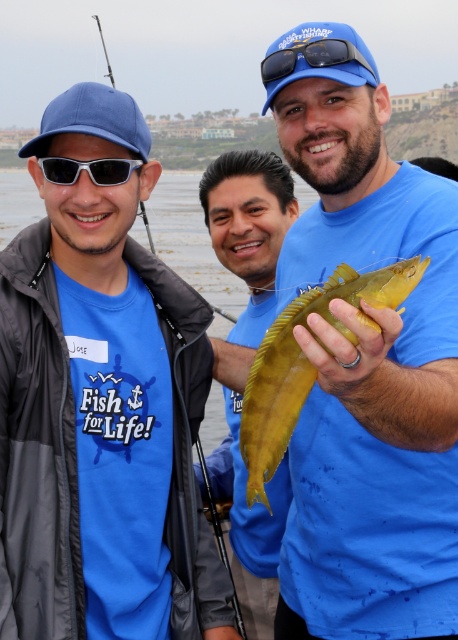
Which of these two, matte blue t-shirt at center or matte yellow fish at center, stands shorter?

With less height is matte blue t-shirt at center.

Which is more to the left, matte blue t-shirt at center or matte yellow fish at center?

Positioned to the left is matte blue t-shirt at center.

Does point (53, 332) lie in front of point (437, 186)?

Yes, it is.

The height and width of the screenshot is (640, 458). Find the location of `matte blue t-shirt at center`. matte blue t-shirt at center is located at coordinates (101, 406).

Which is more to the left, matte blue t-shirt at center or blue matte sunglasses at upper center?

matte blue t-shirt at center

Who is more forward, (99, 218) or (354, 56)?

Point (354, 56)

Who is more forward, [49,106] or [290,67]?

Point [290,67] is more forward.

Where is `matte blue t-shirt at center`? Image resolution: width=458 pixels, height=640 pixels. matte blue t-shirt at center is located at coordinates (101, 406).

In the scene shown: Can you confirm if matte blue t-shirt at center is wider than yellow-green scaley fish at center?

Indeed, matte blue t-shirt at center has a greater width compared to yellow-green scaley fish at center.

Is point (103, 516) closer to camera compared to point (207, 164)?

Yes.

Is point (37, 228) less distant than point (265, 573)?

That is True.

Where is `matte blue t-shirt at center`? matte blue t-shirt at center is located at coordinates (101, 406).